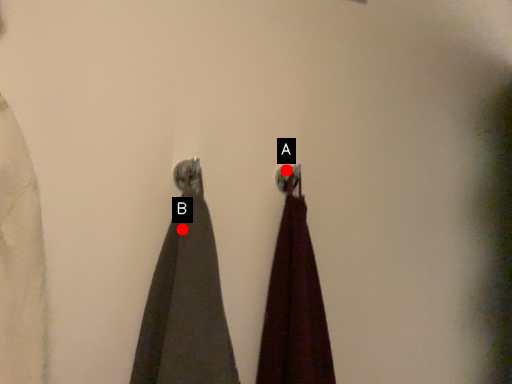
Question: Two points are circled on the image, labeled by A and B beside each circle. Which point is closer to the camera?

Choices:
 (A) A is closer
 (B) B is closer

Answer: (B)